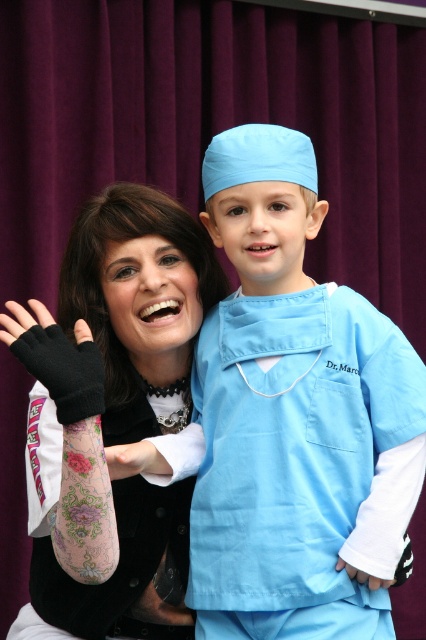
Can you confirm if light blue fabric at center is positioned below floral tattooed arm at center?

Actually, light blue fabric at center is above floral tattooed arm at center.

Can you confirm if light blue fabric at center is taller than floral tattooed arm at center?

Indeed, light blue fabric at center has a greater height compared to floral tattooed arm at center.

This screenshot has width=426, height=640. I want to click on light blue fabric at center, so click(287, 410).

The width and height of the screenshot is (426, 640). Find the location of `light blue fabric at center`. light blue fabric at center is located at coordinates (287, 410).